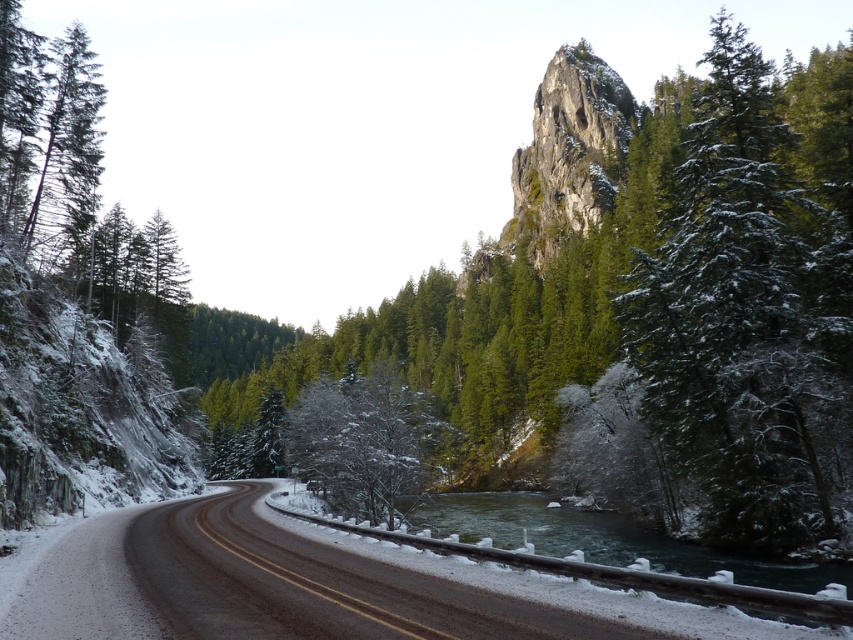
You are driving a car on the black asphalt highway at center and see a green matte tree at upper right. Is the tree located above or below the highway?

The green matte tree at upper right is above the black asphalt highway at center.

You are a hiker planning to take a photo of the green matte tree at upper right from the road. Given that the road is icy, is the point at coordinates (751, 308) accessible for you to safely stand on?

The green matte tree at upper right is located at point (751, 308). Since the road surface is described as slightly damp or icy, this area may not be safe for standing, so it is advisable to avoid standing there to prevent slipping.